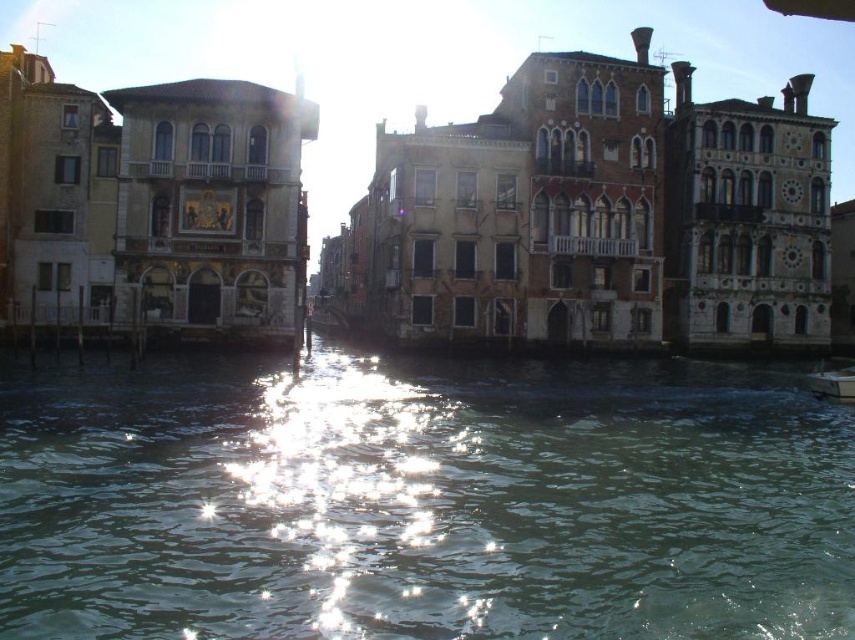
You are a tourist standing at the point with coordinates point [851,372]. You want to take a photo of the point with coordinates point [736,378]. Can you see it directly without any obstructions?

Point [736,378] is behind point [851,372], so you cannot see it directly without moving to a different position.

You are standing on a bridge overlooking the greenish water at center. You want to throw a stone into the water. If you can throw the stone 45 meters, will it land in the water?

The distance between you and the greenish water at center is 44.60 meters. Since your throwing distance is 45 meters, which is slightly longer than the required distance, the stone will land in the water.